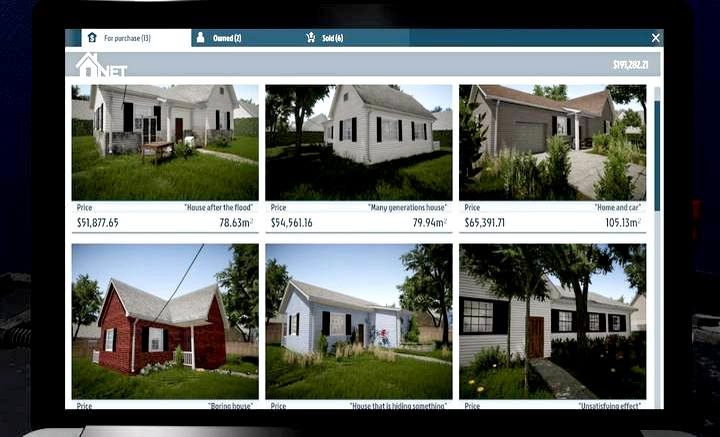
Locate an element on the screen. The width and height of the screenshot is (720, 437). table is located at coordinates (158, 146).